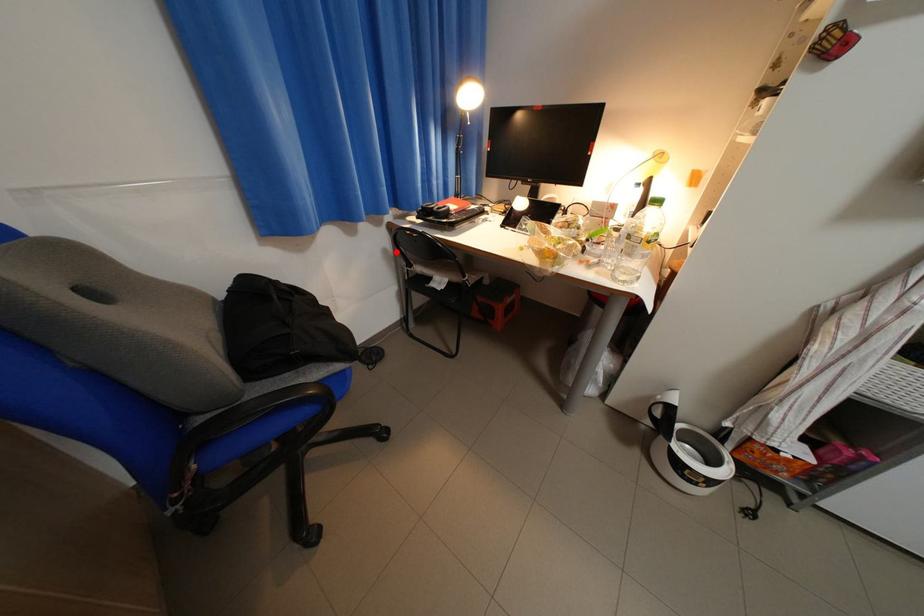
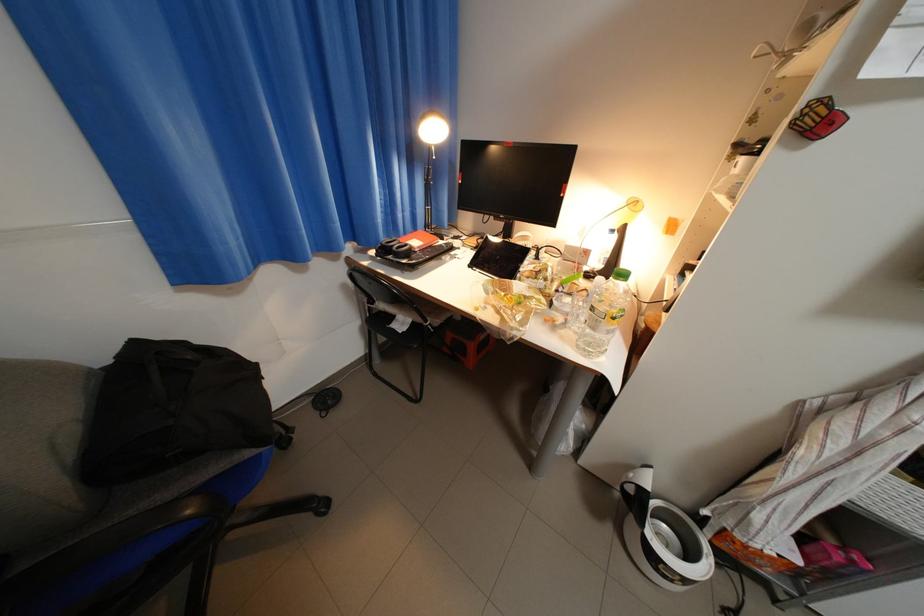
Question: A red point is marked in image1. In image2, is the corresponding 3D point closer to the camera or farther? Reply with the corresponding letter.

Choices:
 (A) The corresponding 3D point is closer.
 (B) The corresponding 3D point is farther.

Answer: (B)